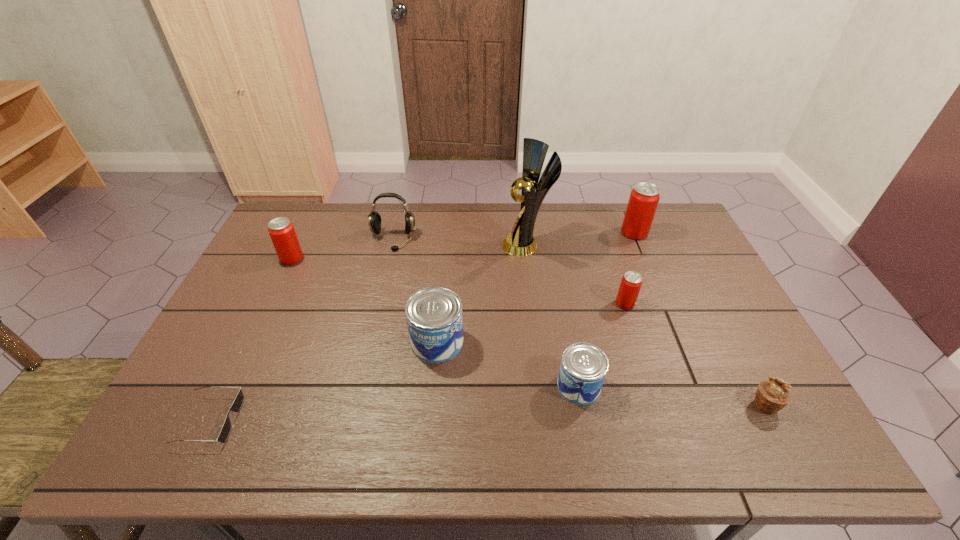
Locate an element on the screen. This screenshot has width=960, height=540. free space at the left edge of the desktop is located at coordinates (276, 254).

The height and width of the screenshot is (540, 960). In the image, there is a desktop. Identify the location of vacant region at the right edge. (684, 253).

Find the location of a particular element. Image resolution: width=960 pixels, height=540 pixels. vacant point located between the shortest object and the fourth nearest object is located at coordinates pos(324,381).

At what (x,y) coordinates should I click in order to perform the action: click on free spot between the leftmost can and the award. Please return your answer as a coordinate pair (x, y). The height and width of the screenshot is (540, 960). Looking at the image, I should click on (409, 252).

The width and height of the screenshot is (960, 540). In order to click on unoccupied area between the rightmost object and the leftmost red can in this screenshot , I will do pyautogui.click(x=528, y=332).

Find the location of `empty space that is in between the black award and the shortest object`. empty space that is in between the black award and the shortest object is located at coordinates (368, 333).

The image size is (960, 540). I want to click on vacant space that's between the third object from left to right and the fourth nearest can, so click(x=343, y=249).

Image resolution: width=960 pixels, height=540 pixels. I want to click on vacant region between the headset and the award, so click(460, 242).

This screenshot has width=960, height=540. What are the coordinates of `empty space that is in between the rightmost object and the second farthest red can` in the screenshot? It's located at (528, 332).

At what (x,y) coordinates should I click in order to perform the action: click on unoccupied position between the nearest red can and the second farthest can. Please return your answer as a coordinate pair (x, y). This screenshot has width=960, height=540. Looking at the image, I should click on (459, 281).